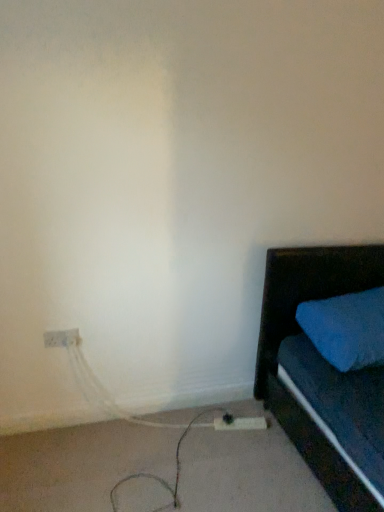
Question: Is white matte cable at lower left positioned far away from white plastic electric outlet at lower left?

Choices:
 (A) yes
 (B) no

Answer: (B)

Question: Is white matte cable at lower left shorter than white plastic electric outlet at lower left?

Choices:
 (A) yes
 (B) no

Answer: (A)

Question: Is white matte cable at lower left at the right side of white plastic electric outlet at lower left?

Choices:
 (A) yes
 (B) no

Answer: (A)

Question: Can you confirm if white matte cable at lower left is taller than white plastic electric outlet at lower left?

Choices:
 (A) yes
 (B) no

Answer: (B)

Question: Is white matte cable at lower left positioned beyond the bounds of white plastic electric outlet at lower left?

Choices:
 (A) yes
 (B) no

Answer: (A)

Question: Choose the correct answer: Is white plastic extension cord at lower center inside white matte cable at lower left or outside it?

Choices:
 (A) outside
 (B) inside

Answer: (B)

Question: Is white plastic extension cord at lower center to the left or to the right of white matte cable at lower left in the image?

Choices:
 (A) right
 (B) left

Answer: (A)

Question: In the image, is white plastic extension cord at lower center positioned in front of or behind white matte cable at lower left?

Choices:
 (A) front
 (B) behind

Answer: (B)

Question: In terms of width, does white plastic extension cord at lower center look wider or thinner when compared to white matte cable at lower left?

Choices:
 (A) wide
 (B) thin

Answer: (B)

Question: Based on their sizes in the image, would you say white plastic electric outlet at lower left is bigger or smaller than white matte cable at lower left?

Choices:
 (A) big
 (B) small

Answer: (B)

Question: From the image's perspective, relative to white matte cable at lower left, is white plastic electric outlet at lower left above or below?

Choices:
 (A) above
 (B) below

Answer: (A)

Question: From a real-world perspective, is white plastic electric outlet at lower left above or below white matte cable at lower left?

Choices:
 (A) above
 (B) below

Answer: (A)

Question: Considering their positions, is white plastic electric outlet at lower left located in front of or behind white matte cable at lower left?

Choices:
 (A) behind
 (B) front

Answer: (A)

Question: Is white plastic extension cord at lower center inside or outside of white plastic electric outlet at lower left?

Choices:
 (A) outside
 (B) inside

Answer: (A)

Question: Is point (243, 424) closer or farther from the camera than point (54, 334)?

Choices:
 (A) closer
 (B) farther

Answer: (B)